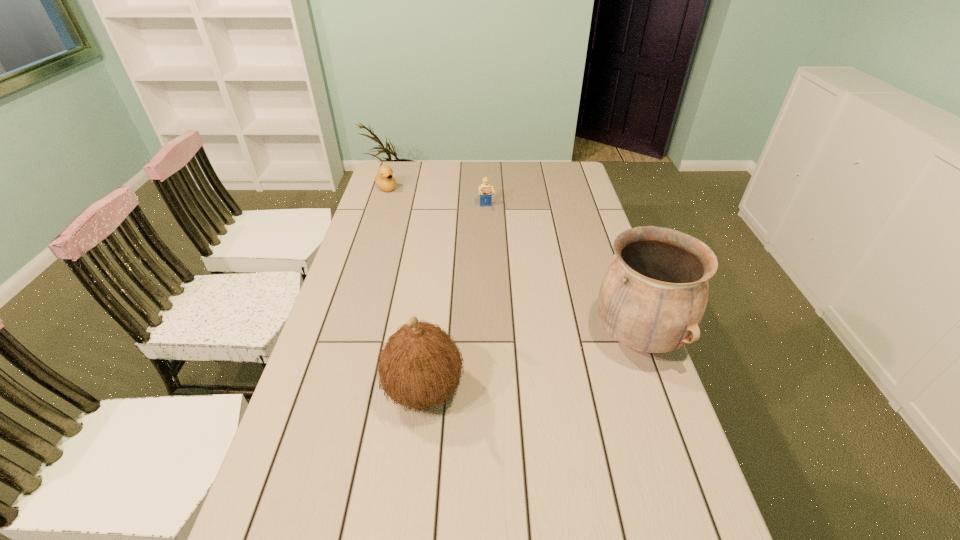
Where is `coconut`? coconut is located at coordinates (420, 366).

Where is `urn`? The height and width of the screenshot is (540, 960). urn is located at coordinates (653, 295).

Where is `the second farthest object`? This screenshot has width=960, height=540. the second farthest object is located at coordinates (485, 192).

Identify the location of Lego. (485, 192).

Locate an element on the screen. the farthest object is located at coordinates (384, 180).

Identify the location of duckling. The height and width of the screenshot is (540, 960). (384, 180).

I want to click on vacant space located 0.110m on the surface of the second object from left to right, so click(x=338, y=390).

Find the location of a particular element. This screenshot has width=960, height=540. free spot located 0.060m on the surface of the second object from left to right is located at coordinates (358, 390).

This screenshot has height=540, width=960. I want to click on vacant space situated on the surface of the second object from left to right, so click(314, 390).

This screenshot has width=960, height=540. I want to click on free location located 0.060m on the back of the rightmost object, so click(620, 291).